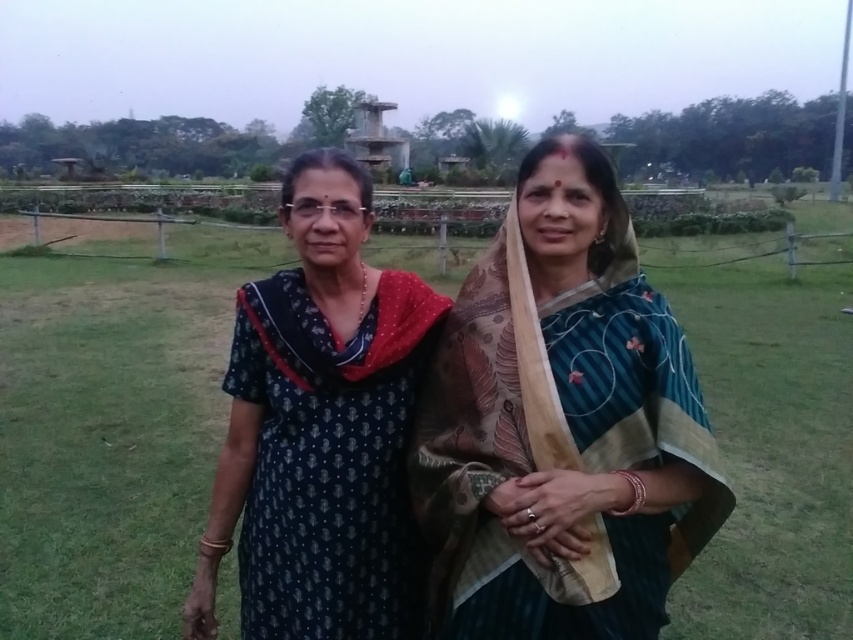
Does embroidered silk saree at center lie behind dark blue printed dress at center?

No, it is not.

Does point (508, 227) come in front of point (341, 360)?

No.

You are a GUI agent. You are given a task and a screenshot of the screen. Output one action in this format:
    pyautogui.click(x=<x>, y=<y>)
    Task: Click on the embroidered silk saree at center
    This screenshot has height=640, width=853.
    Given the screenshot: What is the action you would take?
    pyautogui.click(x=561, y=428)

Is dark blue fabric dress at center below embroidered silk saree at center?

No, dark blue fabric dress at center is not below embroidered silk saree at center.

Between dark blue fabric dress at center and embroidered silk saree at center, which one is positioned lower?

embroidered silk saree at center is lower down.

Where is `dark blue fabric dress at center`? Image resolution: width=853 pixels, height=640 pixels. dark blue fabric dress at center is located at coordinates (112, 429).

Who is lower down, dark blue fabric dress at center or dark blue printed dress at center?

Positioned lower is dark blue printed dress at center.

Which is in front, point (181, 444) or point (271, 410)?

Point (271, 410)

Which is in front, point (7, 387) or point (368, 605)?

Point (368, 605) is more forward.

Locate an element on the screen. dark blue fabric dress at center is located at coordinates pyautogui.click(x=112, y=429).